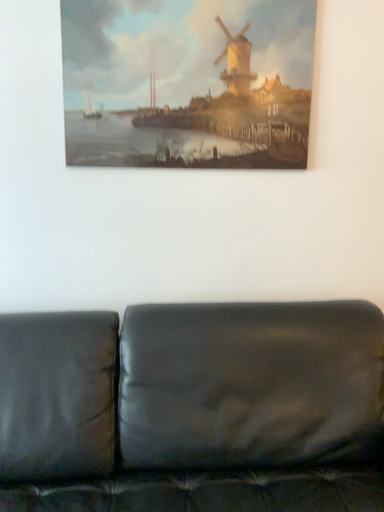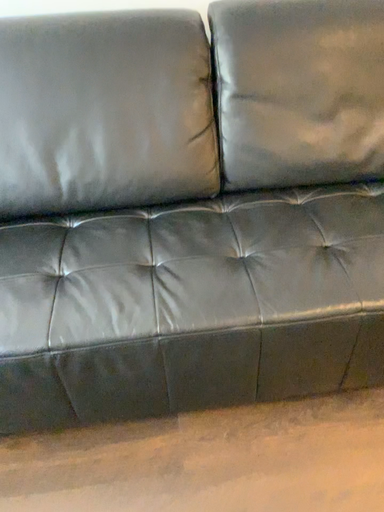
Question: How did the camera likely rotate when shooting the video?

Choices:
 (A) rotated downward
 (B) rotated upward

Answer: (A)